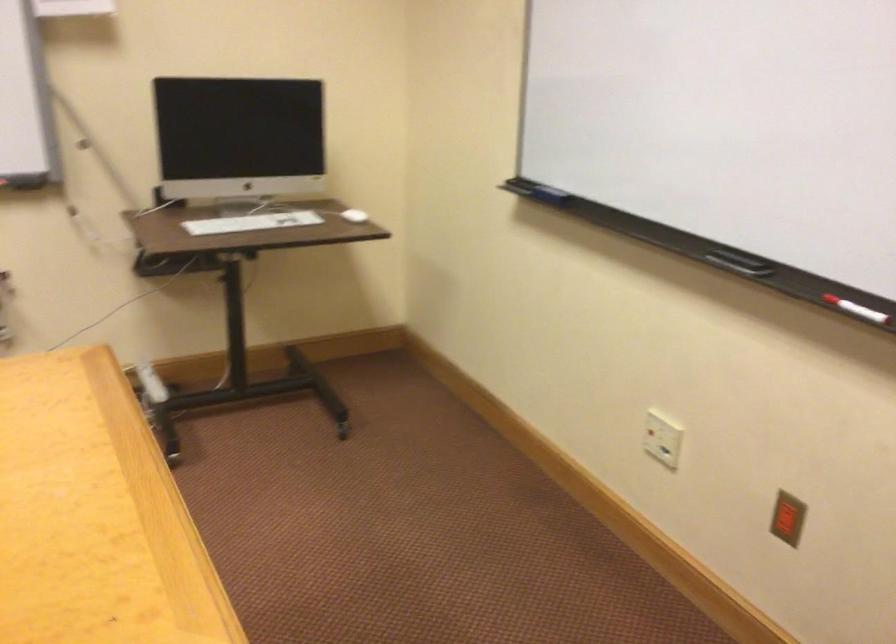
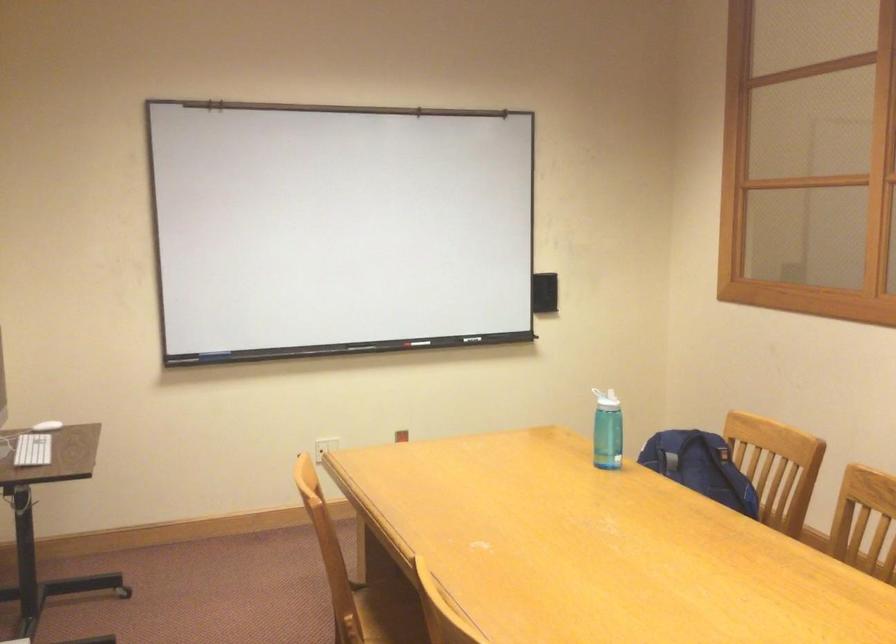
Locate, in the second image, the point that corresponds to [251,222] in the first image.

(32, 450)